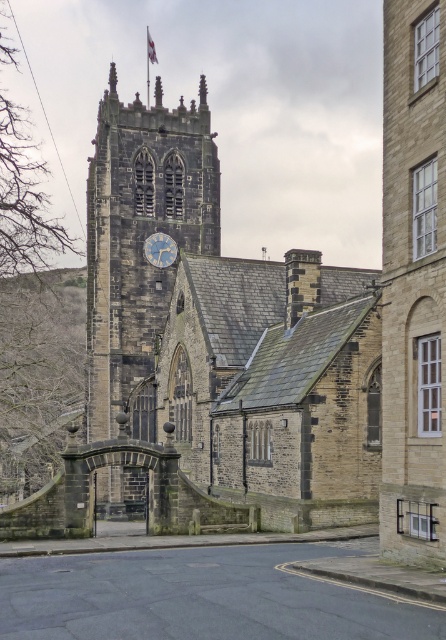
You are a tourist standing in front of the historic stone church. You notice the stone clock tower at center and the blue painted metal clock at center. Which structure would you look up higher to see?

The stone clock tower at center is much taller than the blue painted metal clock at center, so you would need to look up higher to see the stone clock tower at center.

You are standing in front of the historic stone church and want to determine the relative positions of two points marked on its facade. The points are labeled as point 1 at coordinates point [205,230] and point 2 at coordinates point [155,264]. Which point is closer to you, the observer?

Point 1 at coordinates point [205,230] is closer to the observer because it is further to the viewer than point 2 at coordinates point [155,264].

You are an architect designing a new building that needs to fit between two existing structures. You have a blueprint showing the stone clock tower at center and the blue painted metal clock at center. Which object should you consider for the width of your new building to ensure it doesn t block the view of the wider structure?

The stone clock tower at center is wider than the blue painted metal clock at center, so you should consider the width of the stone clock tower at center to ensure the new building doesn t block its view.